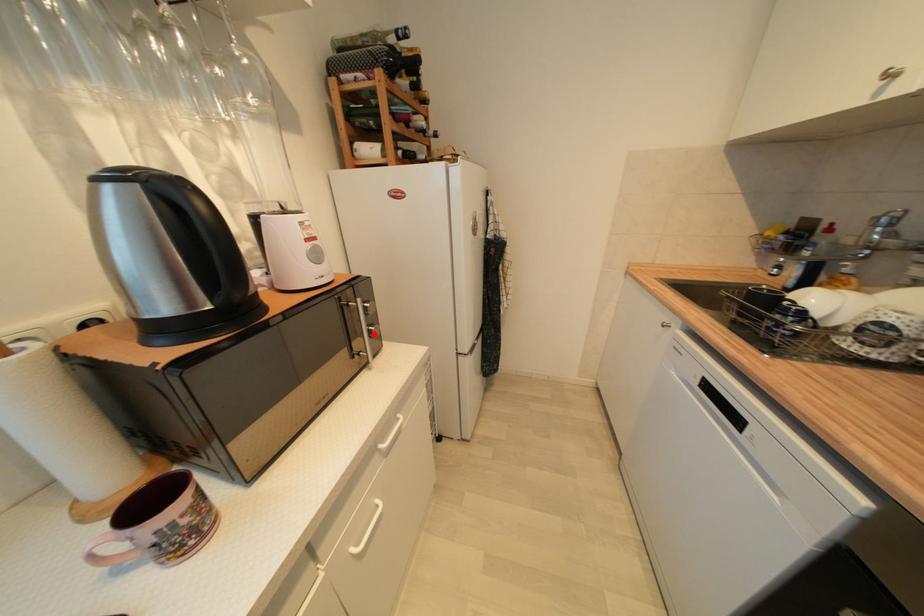
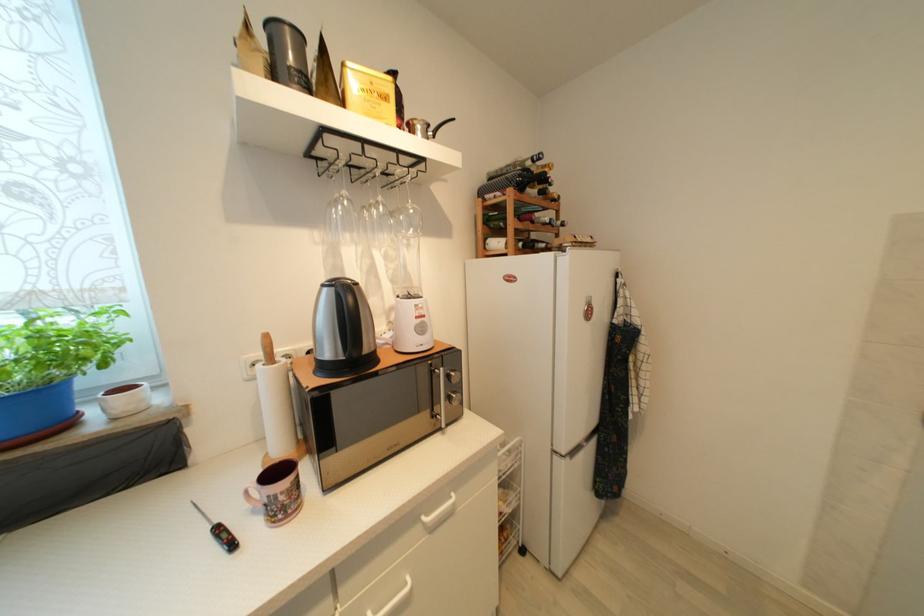
Question: I am providing you with two images of the same scene from different viewpoints. Given a red point in image1, look at the same physical point in image2. Is it:

Choices:
 (A) Closer to the viewpoint
 (B) Farther from the viewpoint

Answer: (B)